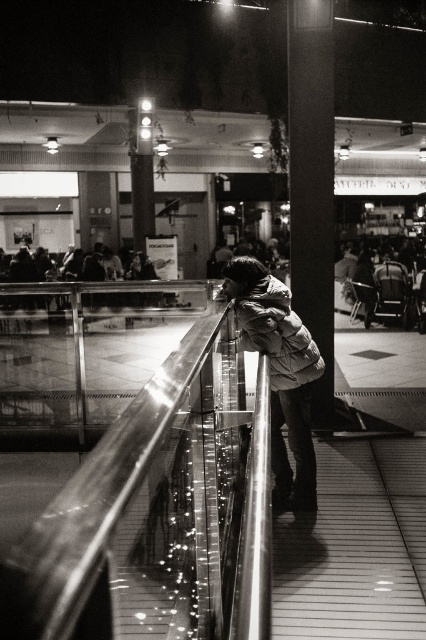
You are a security guard in the mall and need to check the distance between the smooth concrete pillar at center and the white puffy jacket at center. Which object is closer to you?

The smooth concrete pillar at center is closer to you because it is further to the viewer than the white puffy jacket at center, meaning it appears nearer in the image.

From the picture: You are a photographer trying to capture the entire scene in one shot. Given that the smooth concrete pillar at center and the white puffy jacket at center are both in frame, which object would you need to adjust your camera angle to include fully?

The white puffy jacket at center occupies more space than the smooth concrete pillar at center, so you would need to adjust your camera angle to include the white puffy jacket at center fully.